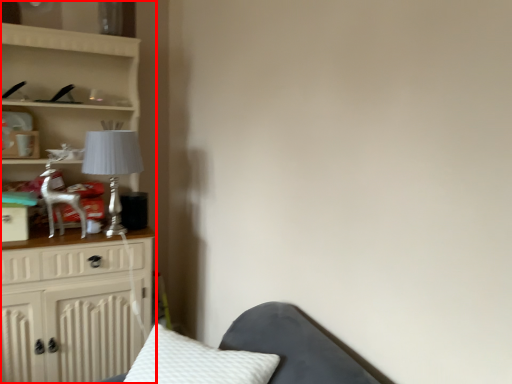
Question: Where is furniture (annotated by the red box) located in relation to table lamp in the image?

Choices:
 (A) right
 (B) left

Answer: (B)